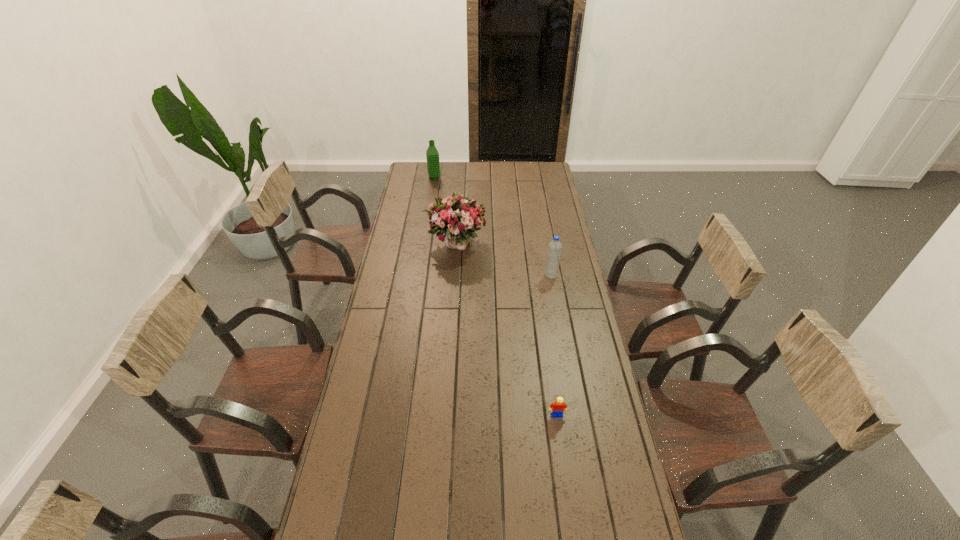
At what (x,y) coordinates should I click in order to perform the action: click on free region located 0.250m on the front-facing side of the nearest object. Please return your answer as a coordinate pair (x, y). This screenshot has height=540, width=960. Looking at the image, I should click on (569, 501).

At what (x,y) coordinates should I click in order to perform the action: click on object positioned at the far edge. Please return your answer as a coordinate pair (x, y). The image size is (960, 540). Looking at the image, I should click on (433, 167).

Locate an element on the screen. This screenshot has height=540, width=960. bouquet that is positioned at the left edge is located at coordinates (457, 216).

The width and height of the screenshot is (960, 540). Find the location of `water bottle situated at the left edge`. water bottle situated at the left edge is located at coordinates (433, 167).

This screenshot has width=960, height=540. What are the coordinates of `water bottle at the right edge` in the screenshot? It's located at (554, 250).

Find the location of a particular element. Image resolution: width=960 pixels, height=540 pixels. Lego present at the right edge is located at coordinates (557, 408).

Find the location of a particular element. object that is at the far left corner is located at coordinates (433, 167).

Locate an element on the screen. Image resolution: width=960 pixels, height=540 pixels. vacant space at the far edge of the desktop is located at coordinates (500, 178).

Where is `free space at the left edge of the desktop`? This screenshot has height=540, width=960. free space at the left edge of the desktop is located at coordinates (393, 294).

Identify the location of free space at the right edge of the desktop. This screenshot has width=960, height=540. (543, 228).